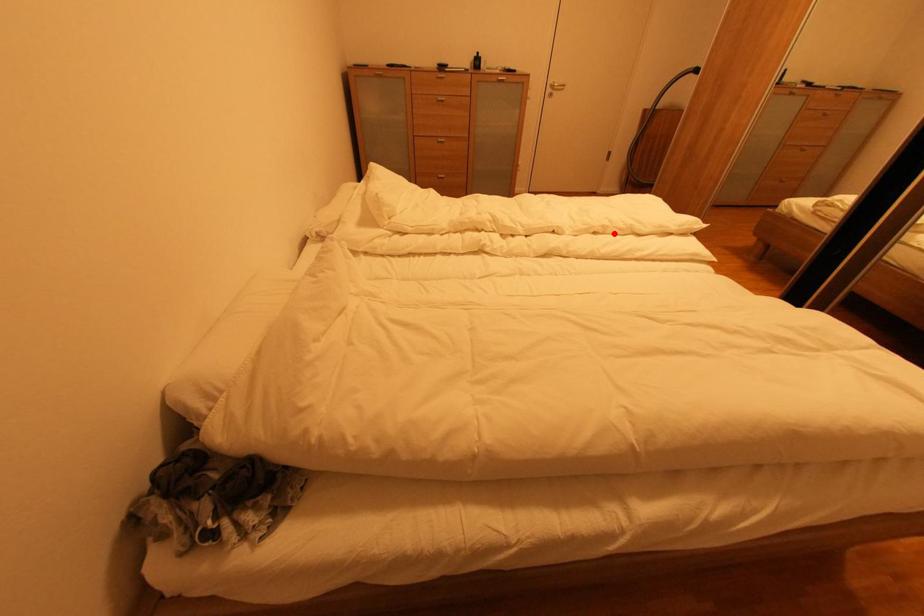
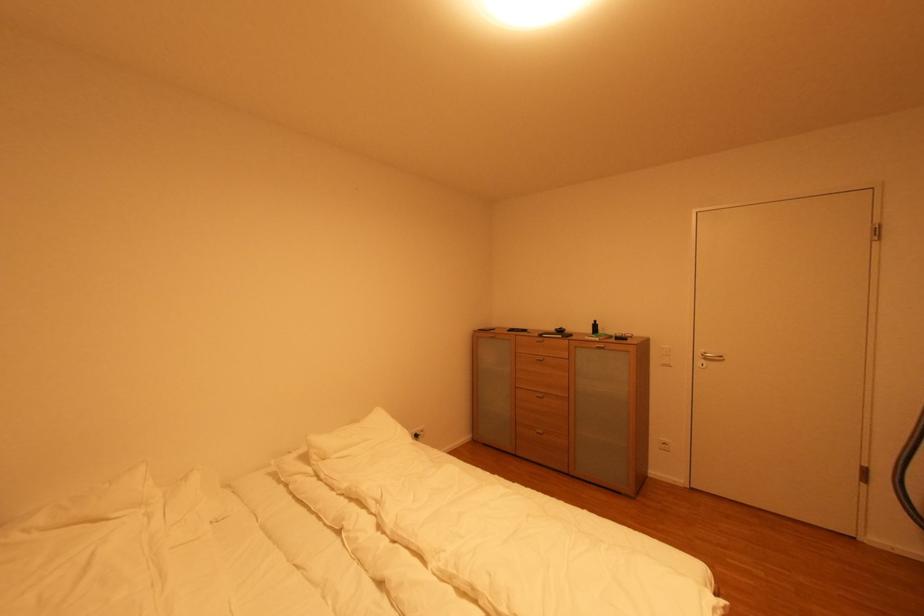
The point at the highlighted location is marked in the first image. Where is the corresponding point in the second image?

(485, 606)